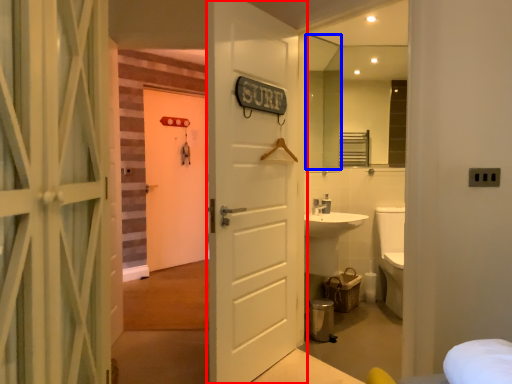
Question: Which object is further to the camera taking this photo, door (highlighted by a red box) or mirror (highlighted by a blue box)?

Choices:
 (A) door
 (B) mirror

Answer: (B)